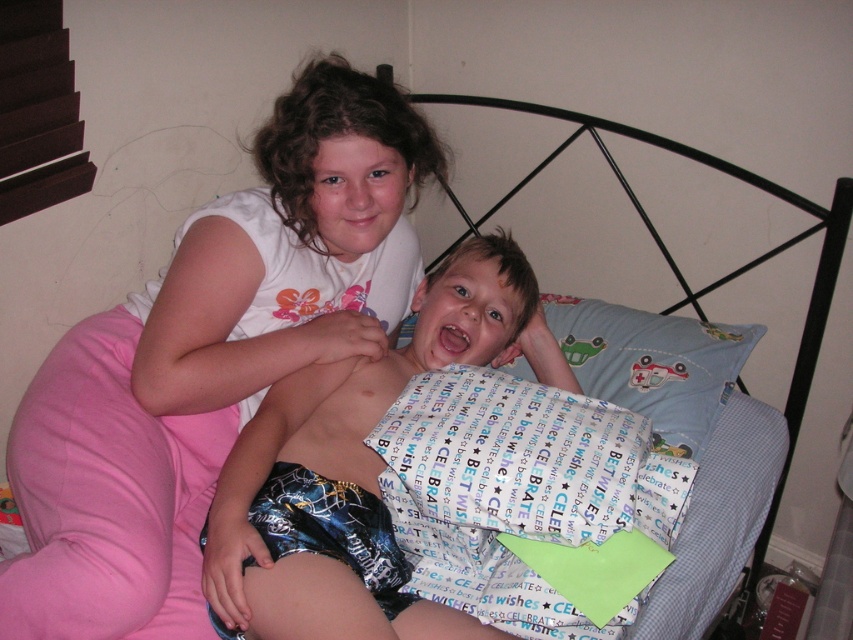
You are a photographer taking a picture of the blue printed shorts at center and the blue fabric pillow at upper center. Which object should you focus on first if you want to capture both in sharp focus?

You should focus on the blue printed shorts at center first because it is closer to the viewer than the blue fabric pillow at upper center, ensuring both will be in focus when using a shallow depth of field.

You are a tailor measuring the width of objects in the image. You need to determine if the blue printed shorts at center can fit over the blue fabric pillow at upper center. Which object is wider?

The blue printed shorts at center might be wider than blue fabric pillow at upper center, so the blue printed shorts at center is wider and cannot fit over the blue fabric pillow at upper center.

You are a tailor who needs to determine which item requires more fabric for a custom order. Based on the image, which item is larger in size between the blue printed shorts at center and the blue fabric pillow at upper center?

The blue printed shorts at center is bigger than blue fabric pillow at upper center, so the blue printed shorts at center would require more fabric for a custom order.